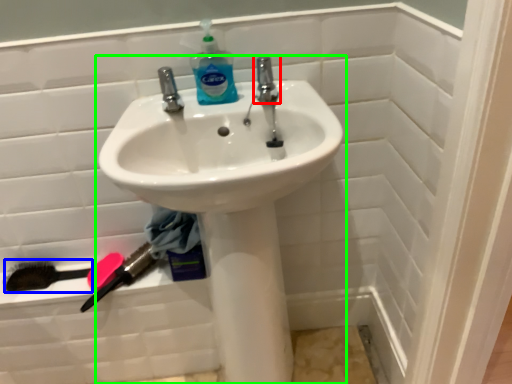
Question: Which object is the closest to the tap (highlighted by a red box)? Choose among these: brush (highlighted by a blue box) or sink (highlighted by a green box).

Choices:
 (A) brush
 (B) sink

Answer: (B)